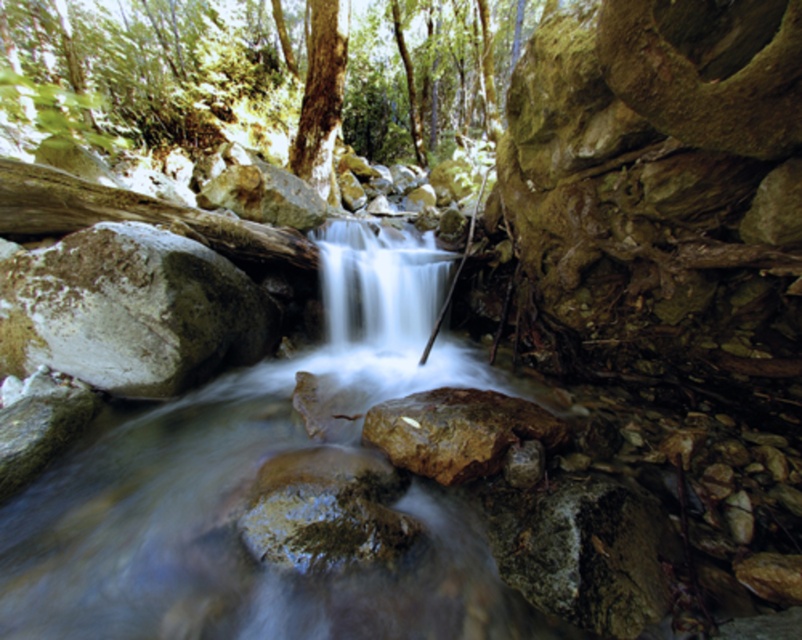
You are a photographer planning to capture a photo of the brown rough rock at left and the white smooth waterfall at center. If you want to ensure both objects are fully visible in your frame, which object requires more space in the composition?

The white smooth waterfall at center requires more space in the composition because its width is greater than the brown rough rock at left.

You are standing at the point labeled point (x=130, y=310) in the image. What object are you standing on?

You are standing on the brown rough rock at left.

You are standing at the edge of the waterfall and want to place a small decorative rock at each of the two points labeled point (399,337) and point (322,189). Which point is closer to you where you can place the rock more easily?

Point (399,337) is closer to the viewer than point (322,189), so you can place the rock more easily at point (399,337).